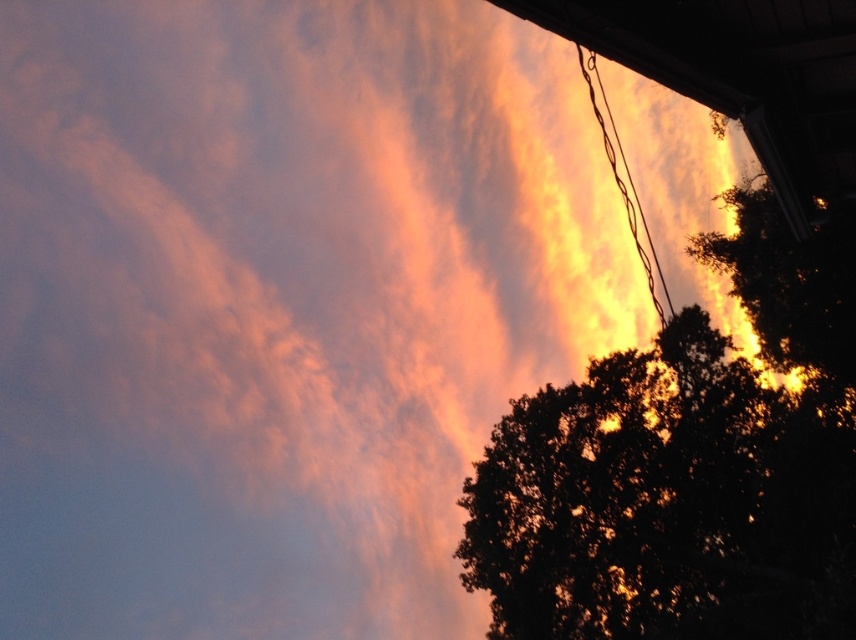
You are an architect designing a new solar panel installation. You need to place panels on the roof visible in the image. Considering the silhouette leafy tree at upper right, which is located at coordinates point 0.730, 0.805, will it cast a shadow on the roof during sunset? Please explain your reasoning based on the tree position and the sunset direction.

The silhouette leafy tree at upper right is positioned at point (x=688, y=467). Since the sunset occurs in the western direction, if the tree is to the west of the roof, its shadow would likely fall on the roof. However, without knowing the exact orientation of the roof and the tree relative to the sunset direction, it is difficult to determine definitively. The coordinates alone do not provide enough information about the directional relationship between the tree and the sunset.